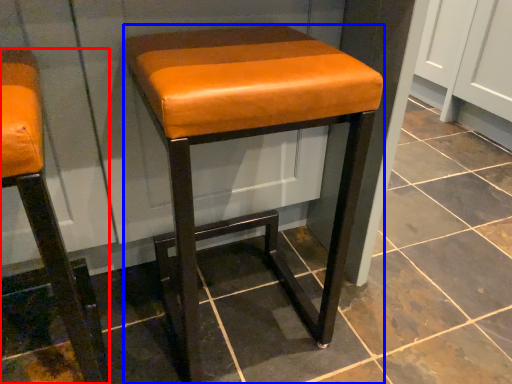
Question: Which object appears closest to the camera in this image, stool (highlighted by a red box) or stool (highlighted by a blue box)?

Choices:
 (A) stool
 (B) stool

Answer: (A)